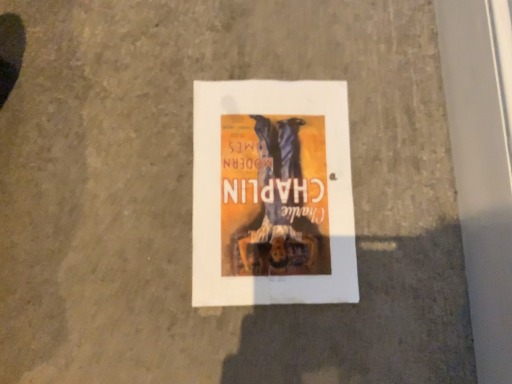
Image resolution: width=512 pixels, height=384 pixels. I want to click on blank space situated above white paper poster at center (from a real-world perspective), so click(272, 180).